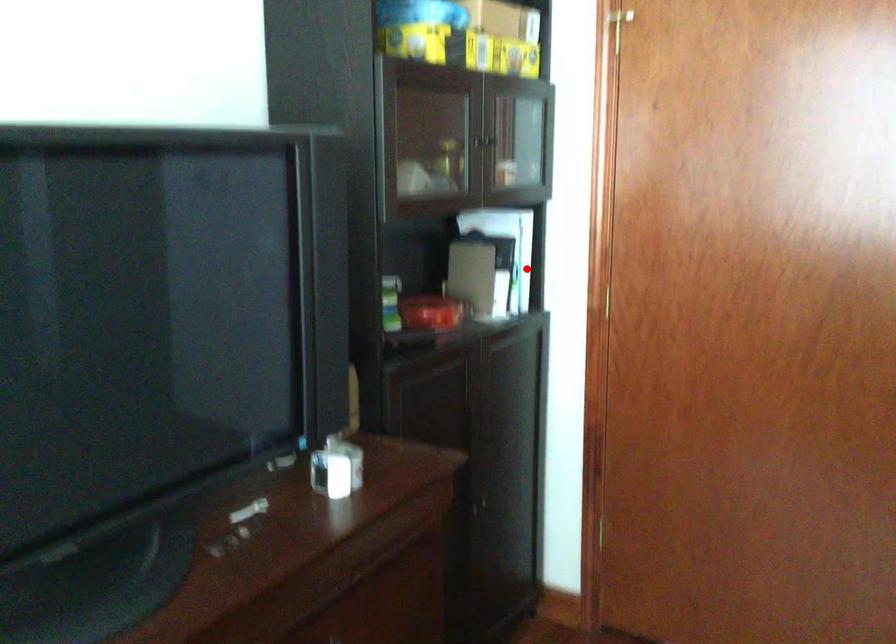
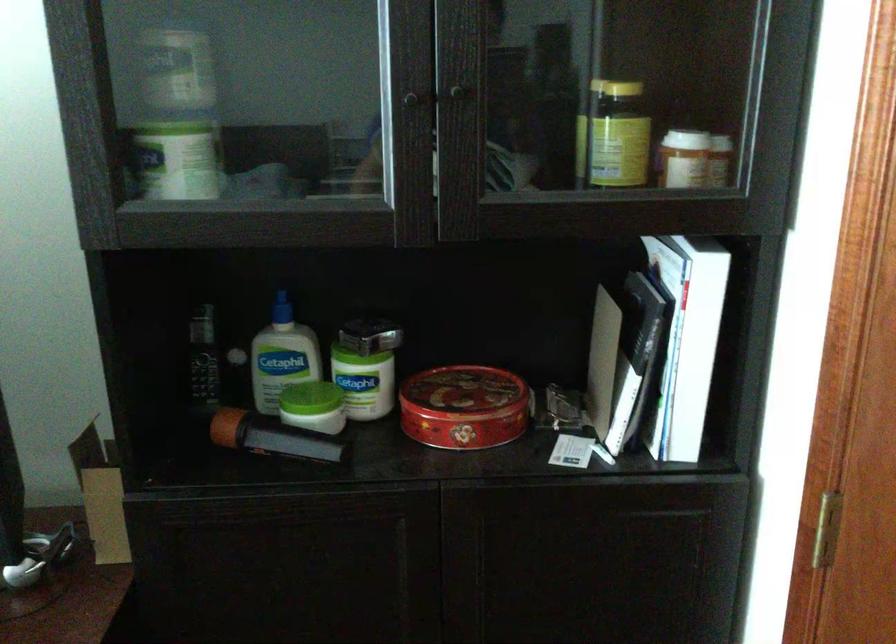
Question: I am providing you with two images of the same scene from different viewpoints. In image1, a red point is highlighted. Considering the same 3D point in image2, which of the following is correct?

Choices:
 (A) It is closer
 (B) It is farther

Answer: (A)